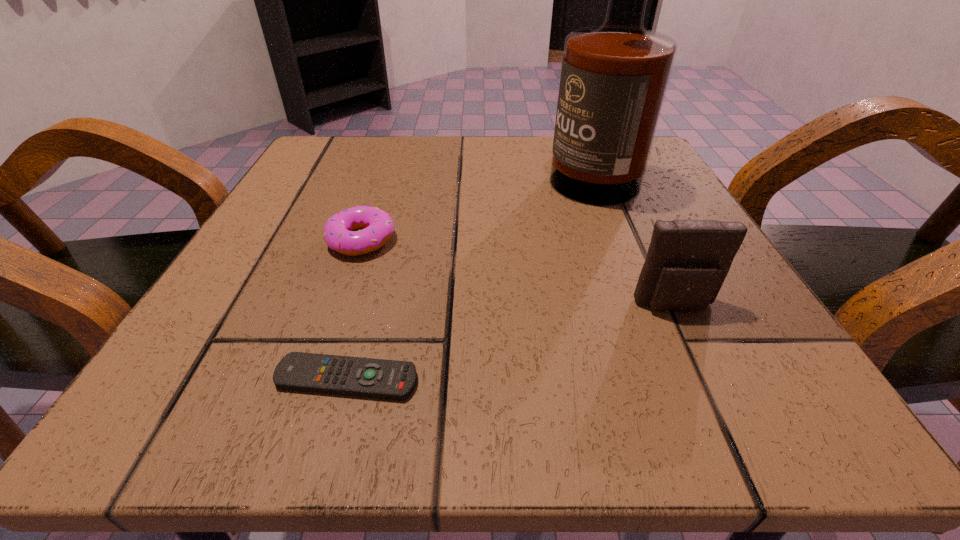
Identify which object is the nearest to the pouch. Please provide its 2D coordinates. Your answer should be formatted as a tuple, i.e. [(x, y)], where the tuple contains the x and y coordinates of a point satisfying the conditions above.

[(614, 77)]

Locate an element on the screen. Image resolution: width=960 pixels, height=540 pixels. free spot that satisfies the following two spatial constraints: 1. on the front label of the liquor; 2. on the front side of the third tallest object is located at coordinates (616, 240).